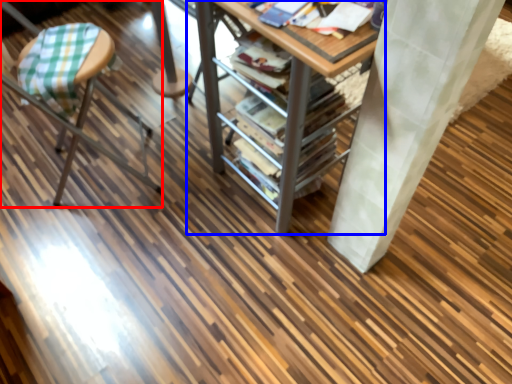
Question: Which of the following is the farthest to the observer, furniture (highlighted by a red box) or table (highlighted by a blue box)?

Choices:
 (A) furniture
 (B) table

Answer: (A)